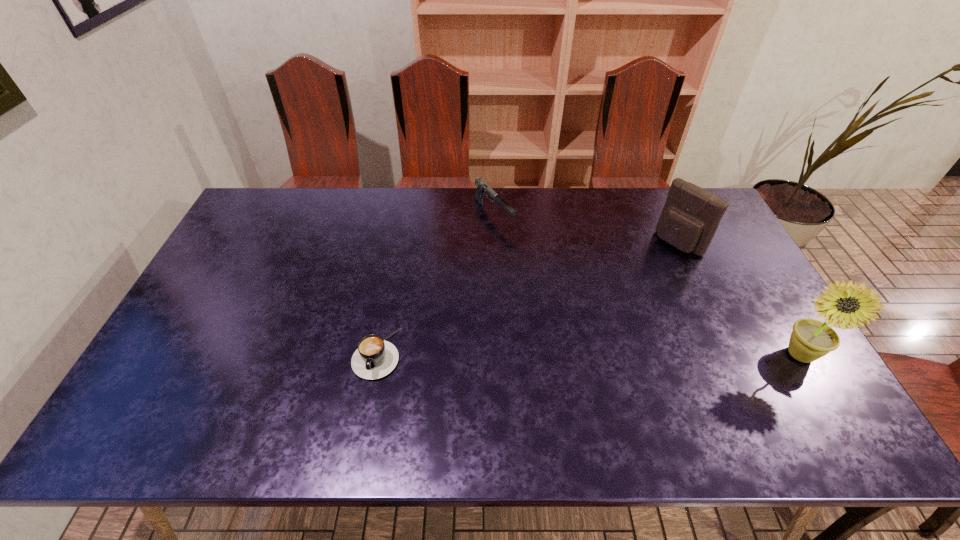
You are a GUI agent. You are given a task and a screenshot of the screen. Output one action in this format:
    pyautogui.click(x=<x>, y=<y>)
    Task: Click on the vacant area between the sunflower and the pouch
    
    Given the screenshot: What is the action you would take?
    pyautogui.click(x=738, y=299)

Find the location of a particular element. This screenshot has height=540, width=960. empty location between the second shortest object and the cappuccino is located at coordinates (436, 284).

At what (x,y) coordinates should I click in order to perform the action: click on vacant region between the sunflower and the third object from left to right. Please return your answer as a coordinate pair (x, y). Looking at the image, I should click on (738, 299).

You are a GUI agent. You are given a task and a screenshot of the screen. Output one action in this format:
    pyautogui.click(x=<x>, y=<y>)
    Task: Click on the free space between the second tallest object and the rightmost object
    
    Given the screenshot: What is the action you would take?
    pyautogui.click(x=738, y=299)

You are a GUI agent. You are given a task and a screenshot of the screen. Output one action in this format:
    pyautogui.click(x=<x>, y=<y>)
    Task: Click on the free spot between the cappuccino and the second object from right to left
    This screenshot has width=960, height=540.
    Given the screenshot: What is the action you would take?
    (527, 298)

In order to click on free space between the gun and the sunflower in this screenshot , I will do (646, 285).

Image resolution: width=960 pixels, height=540 pixels. Find the location of `empty location between the cappuccino and the third object from left to right`. empty location between the cappuccino and the third object from left to right is located at coordinates (527, 298).

At what (x,y) coordinates should I click in order to perform the action: click on unoccupied position between the tallest object and the third shortest object. Please return your answer as a coordinate pair (x, y). Looking at the image, I should click on (738, 299).

The width and height of the screenshot is (960, 540). Find the location of `the third closest object to the second shortest object`. the third closest object to the second shortest object is located at coordinates (811, 339).

Select which object appears as the third closest to the second tallest object. Please provide its 2D coordinates. Your answer should be formatted as a tuple, i.e. [(x, y)], where the tuple contains the x and y coordinates of a point satisfying the conditions above.

[(375, 358)]